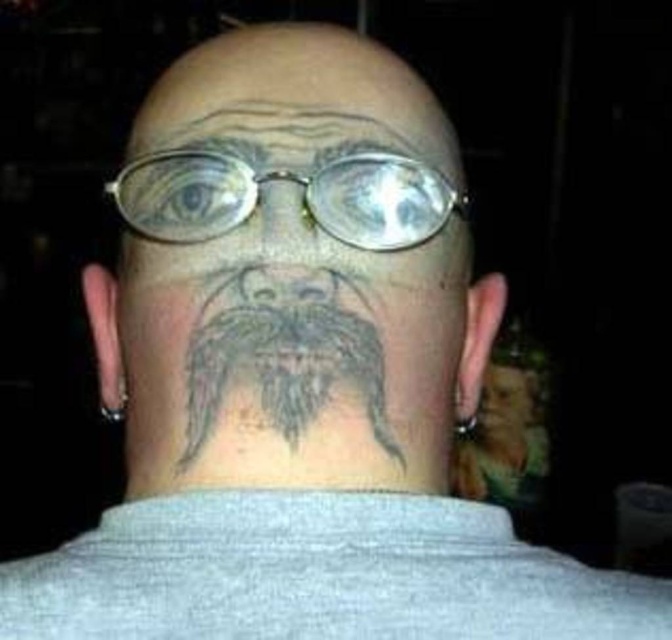
Can you confirm if gray tattooed face at center is positioned to the left of gray tattooed beard at center?

Incorrect, gray tattooed face at center is not on the left side of gray tattooed beard at center.

Which is behind, point (157, 448) or point (372, 337)?

The point (157, 448) is behind.

Image resolution: width=672 pixels, height=640 pixels. Find the location of `gray tattooed face at center`. gray tattooed face at center is located at coordinates (288, 280).

Where is `gray tattooed face at center`? gray tattooed face at center is located at coordinates (288, 280).

Which is more to the left, gray tattooed beard at center or gray/black hair at upper center?

Positioned to the left is gray tattooed beard at center.

Does point (214, 374) lie in front of point (214, 115)?

That is True.

The width and height of the screenshot is (672, 640). What do you see at coordinates (284, 369) in the screenshot?
I see `gray tattooed beard at center` at bounding box center [284, 369].

You are a GUI agent. You are given a task and a screenshot of the screen. Output one action in this format:
    pyautogui.click(x=<x>, y=<y>)
    Task: Click on the gray tattooed beard at center
    
    Given the screenshot: What is the action you would take?
    pyautogui.click(x=284, y=369)

Who is lower down, gray tattooed forehead at upper center or gray tattooed beard at center?

gray tattooed beard at center is lower down.

Locate an element on the screen. The width and height of the screenshot is (672, 640). gray tattooed forehead at upper center is located at coordinates (292, 83).